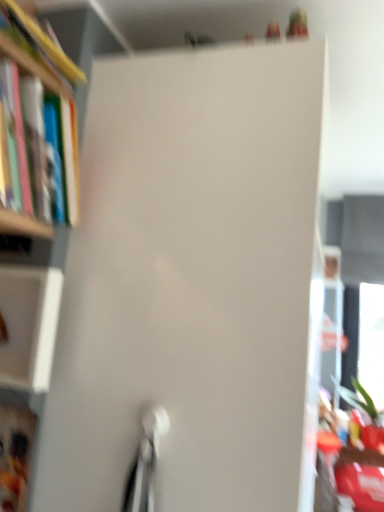
The width and height of the screenshot is (384, 512). What do you see at coordinates (29, 325) in the screenshot?
I see `white matte cabinet at left, placed as the first cabinet when sorted from top to bottom` at bounding box center [29, 325].

Image resolution: width=384 pixels, height=512 pixels. Describe the element at coordinates (45, 42) in the screenshot. I see `hardcover book at left, acting as the 1th book starting from the top` at that location.

What are the coordinates of `white matte cabinet at left, the second cabinet from the bottom` in the screenshot? It's located at (x=29, y=325).

Which object is wider, hardcover book at left, which is counted as the 1th book, starting from the bottom, or hardcover book at left, acting as the 1th book starting from the top?

hardcover book at left, acting as the 1th book starting from the top, is wider.

From the image's perspective, is hardcover book at left, which is counted as the 1th book, starting from the bottom, on hardcover book at left, which is the second book from bottom to top?

No, from the image's perspective, hardcover book at left, which is counted as the 1th book, starting from the bottom, is not over hardcover book at left, which is the second book from bottom to top.

Is hardcover book at left, the second book when ordered from top to bottom, not inside hardcover book at left, which is the second book from bottom to top?

hardcover book at left, the second book when ordered from top to bottom, is positioned outside hardcover book at left, which is the second book from bottom to top.

Is hardcover book at left, the second book when ordered from top to bottom, turned away from hardcover book at left, which is the second book from bottom to top?

No.

Is matte plastic cabinet at lower left, which appears as the 1th cabinet when ordered from the bottom, positioned far away from hardcover book at left, which is the second book from bottom to top?

Actually, matte plastic cabinet at lower left, which appears as the 1th cabinet when ordered from the bottom, and hardcover book at left, which is the second book from bottom to top, are a little close together.

From the image's perspective, which object appears higher, matte plastic cabinet at lower left, the second cabinet from the top, or hardcover book at left, acting as the 1th book starting from the top?

From the image's view, hardcover book at left, acting as the 1th book starting from the top, is above.

Where is `the 2nd cabinet positioned below the hardcover book at left, acting as the 1th book starting from the top (from a real-world perspective)`? This screenshot has width=384, height=512. the 2nd cabinet positioned below the hardcover book at left, acting as the 1th book starting from the top (from a real-world perspective) is located at coordinates (15, 450).

Is matte plastic cabinet at lower left, the second cabinet from the top, aimed at hardcover book at left, which is the second book from bottom to top?

No, matte plastic cabinet at lower left, the second cabinet from the top, is not facing towards hardcover book at left, which is the second book from bottom to top.

Find the location of a particular element. the 1st book in front of the matte plastic cabinet at lower left, which appears as the 1th cabinet when ordered from the bottom, counting from the anchor's position is located at coordinates (68, 164).

Which is less distant, [23,83] or [31,462]?

Point [23,83].

Considering the sizes of objects hardcover book at left, which is counted as the 1th book, starting from the bottom, and matte plastic cabinet at lower left, which appears as the 1th cabinet when ordered from the bottom, in the image provided, who is wider, hardcover book at left, which is counted as the 1th book, starting from the bottom, or matte plastic cabinet at lower left, which appears as the 1th cabinet when ordered from the bottom,?

With larger width is hardcover book at left, which is counted as the 1th book, starting from the bottom.

Is point (44, 206) more distant than point (52, 333)?

No.

From the image's perspective, does hardcover book at left, the second book when ordered from top to bottom, appear lower than white matte cabinet at left, placed as the first cabinet when sorted from top to bottom?

No.

Which of these two, hardcover book at left, the second book when ordered from top to bottom, or white matte cabinet at left, placed as the first cabinet when sorted from top to bottom, is smaller?

white matte cabinet at left, placed as the first cabinet when sorted from top to bottom.

Would you consider hardcover book at left, the second book when ordered from top to bottom, to be distant from white matte cabinet at left, placed as the first cabinet when sorted from top to bottom?

hardcover book at left, the second book when ordered from top to bottom, is near white matte cabinet at left, placed as the first cabinet when sorted from top to bottom, not far away.

Is white matte cabinet at left, placed as the first cabinet when sorted from top to bottom, located outside hardcover book at left, which is the second book from bottom to top?

white matte cabinet at left, placed as the first cabinet when sorted from top to bottom, lies outside hardcover book at left, which is the second book from bottom to top,'s area.

The height and width of the screenshot is (512, 384). Find the location of `book on the right of white matte cabinet at left, the second cabinet from the bottom`. book on the right of white matte cabinet at left, the second cabinet from the bottom is located at coordinates (45, 42).

Looking at this image, could you tell me if white matte cabinet at left, placed as the first cabinet when sorted from top to bottom, is turned towards hardcover book at left, which is the second book from bottom to top?

No.

Considering the positions of objects hardcover book at left, acting as the 1th book starting from the top, and hardcover book at left, the second book when ordered from top to bottom, in the image provided, who is behind, hardcover book at left, acting as the 1th book starting from the top, or hardcover book at left, the second book when ordered from top to bottom,?

hardcover book at left, the second book when ordered from top to bottom, is more distant.

What are the coordinates of `book that is above the hardcover book at left, which is counted as the 1th book, starting from the bottom (from the image's perspective)` in the screenshot? It's located at (45, 42).

Can you confirm if hardcover book at left, which is the second book from bottom to top, is wider than hardcover book at left, the second book when ordered from top to bottom?

Correct, the width of hardcover book at left, which is the second book from bottom to top, exceeds that of hardcover book at left, the second book when ordered from top to bottom.

Based on the photo, is hardcover book at left, which is the second book from bottom to top, positioned far away from hardcover book at left, which is counted as the 1th book, starting from the bottom?

No, hardcover book at left, which is the second book from bottom to top, is not far away from hardcover book at left, which is counted as the 1th book, starting from the bottom.

Is white matte cabinet at left, the second cabinet from the bottom, spatially inside hardcover book at left, the second book when ordered from top to bottom, or outside of it?

The correct answer is: outside.

From a real-world perspective, is white matte cabinet at left, the second cabinet from the bottom, physically below hardcover book at left, which is counted as the 1th book, starting from the bottom?

Yes, from a real-world perspective, white matte cabinet at left, the second cabinet from the bottom, is under hardcover book at left, which is counted as the 1th book, starting from the bottom.

Which is in front, point (36, 303) or point (28, 151)?

The point (28, 151) is more forward.

From the image's perspective, which one is positioned lower, white matte cabinet at left, placed as the first cabinet when sorted from top to bottom, or hardcover book at left, which is counted as the 1th book, starting from the bottom?

white matte cabinet at left, placed as the first cabinet when sorted from top to bottom, appears lower in the image.

The height and width of the screenshot is (512, 384). Identify the location of book above the hardcover book at left, which is counted as the 1th book, starting from the bottom (from the image's perspective). (45, 42).

Identify the location of the 2nd cabinet counting from the left side of the hardcover book at left, acting as the 1th book starting from the top. [15, 450].

Looking at the image, which one is located further to matte plastic cabinet at lower left, the second cabinet from the top, hardcover book at left, acting as the 1th book starting from the top, or hardcover book at left, which is counted as the 1th book, starting from the bottom?

Based on the image, hardcover book at left, acting as the 1th book starting from the top, appears to be further to matte plastic cabinet at lower left, the second cabinet from the top.

Estimate the real-world distances between objects in this image. Which object is closer to hardcover book at left, which is counted as the 1th book, starting from the bottom, hardcover book at left, which is the second book from bottom to top, or matte plastic cabinet at lower left, which appears as the 1th cabinet when ordered from the bottom?

hardcover book at left, which is the second book from bottom to top, is positioned closer to the anchor hardcover book at left, which is counted as the 1th book, starting from the bottom.

Based on their spatial positions, is hardcover book at left, which is counted as the 1th book, starting from the bottom, or hardcover book at left, which is the second book from bottom to top, further from matte plastic cabinet at lower left, which appears as the 1th cabinet when ordered from the bottom?

The object further to matte plastic cabinet at lower left, which appears as the 1th cabinet when ordered from the bottom, is hardcover book at left, which is the second book from bottom to top.

Which object lies further to the anchor point hardcover book at left, which is the second book from bottom to top, white matte cabinet at left, the second cabinet from the bottom, or matte plastic cabinet at lower left, which appears as the 1th cabinet when ordered from the bottom?

Among the two, matte plastic cabinet at lower left, which appears as the 1th cabinet when ordered from the bottom, is located further to hardcover book at left, which is the second book from bottom to top.

In the scene shown: Based on their spatial positions, is matte plastic cabinet at lower left, which appears as the 1th cabinet when ordered from the bottom, or white matte cabinet at left, placed as the first cabinet when sorted from top to bottom, closer to hardcover book at left, which is the second book from bottom to top?

white matte cabinet at left, placed as the first cabinet when sorted from top to bottom, is closer to hardcover book at left, which is the second book from bottom to top.

Which object lies further to the anchor point matte plastic cabinet at lower left, the second cabinet from the top, hardcover book at left, which is the second book from bottom to top, or white matte cabinet at left, the second cabinet from the bottom?

hardcover book at left, which is the second book from bottom to top, is further to matte plastic cabinet at lower left, the second cabinet from the top.

Looking at the image, which one is located further to white matte cabinet at left, the second cabinet from the bottom, hardcover book at left, the second book when ordered from top to bottom, or hardcover book at left, acting as the 1th book starting from the top?

The object further to white matte cabinet at left, the second cabinet from the bottom, is hardcover book at left, acting as the 1th book starting from the top.

Estimate the real-world distances between objects in this image. Which object is further from hardcover book at left, the second book when ordered from top to bottom, matte plastic cabinet at lower left, which appears as the 1th cabinet when ordered from the bottom, or hardcover book at left, which is the second book from bottom to top?

The object further to hardcover book at left, the second book when ordered from top to bottom, is matte plastic cabinet at lower left, which appears as the 1th cabinet when ordered from the bottom.

The image size is (384, 512). Find the location of `cabinet between hardcover book at left, acting as the 1th book starting from the top, and matte plastic cabinet at lower left, which appears as the 1th cabinet when ordered from the bottom, vertically`. cabinet between hardcover book at left, acting as the 1th book starting from the top, and matte plastic cabinet at lower left, which appears as the 1th cabinet when ordered from the bottom, vertically is located at coordinates (29, 325).

The image size is (384, 512). I want to click on book between hardcover book at left, acting as the 1th book starting from the top, and white matte cabinet at left, placed as the first cabinet when sorted from top to bottom, vertically, so click(x=68, y=164).

Where is `book between hardcover book at left, acting as the 1th book starting from the top, and matte plastic cabinet at lower left, the second cabinet from the top, in the vertical direction`? The image size is (384, 512). book between hardcover book at left, acting as the 1th book starting from the top, and matte plastic cabinet at lower left, the second cabinet from the top, in the vertical direction is located at coordinates (68, 164).

Where is `cabinet between hardcover book at left, the second book when ordered from top to bottom, and matte plastic cabinet at lower left, which appears as the 1th cabinet when ordered from the bottom, vertically`? cabinet between hardcover book at left, the second book when ordered from top to bottom, and matte plastic cabinet at lower left, which appears as the 1th cabinet when ordered from the bottom, vertically is located at coordinates (29, 325).